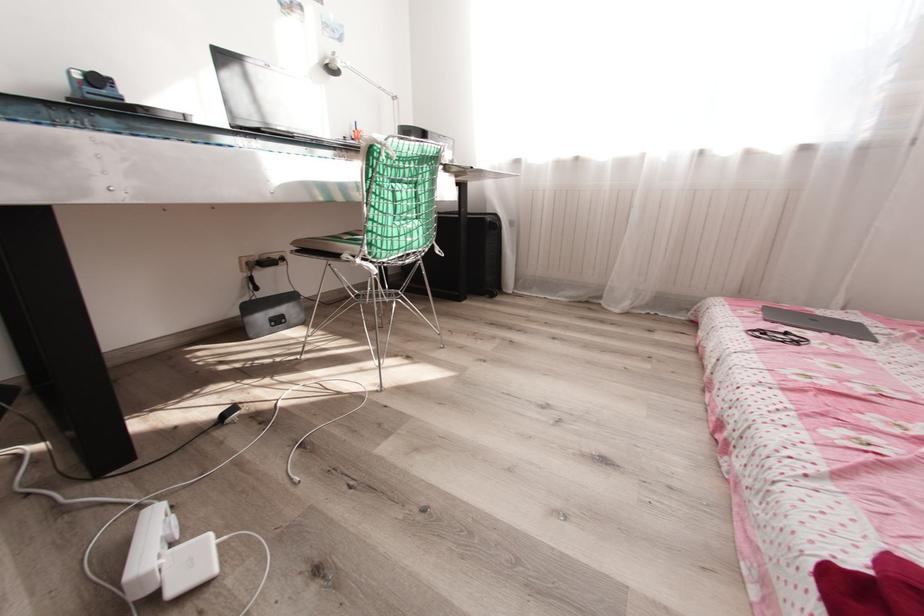
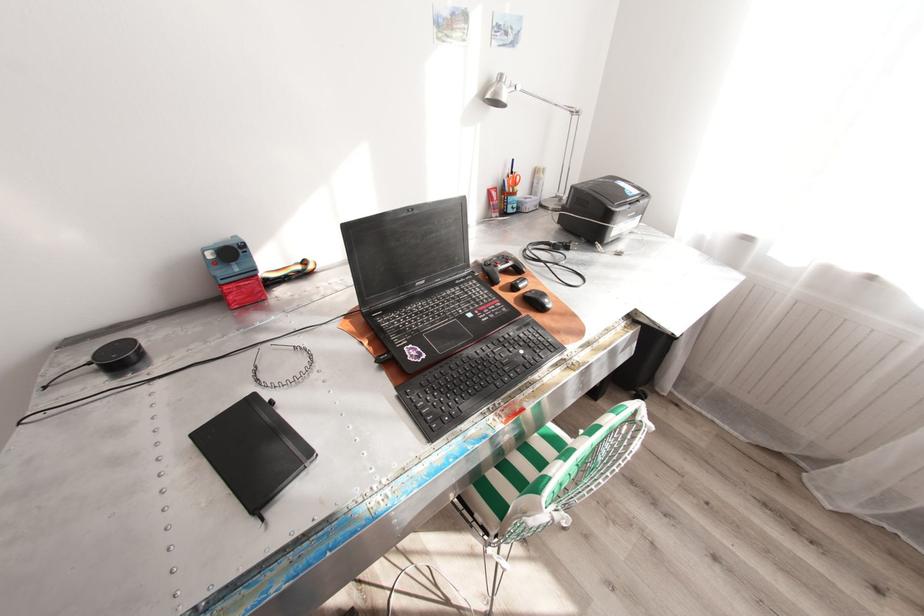
Locate, in the second image, the point that corresponds to (x=360, y=130) in the first image.

(517, 172)